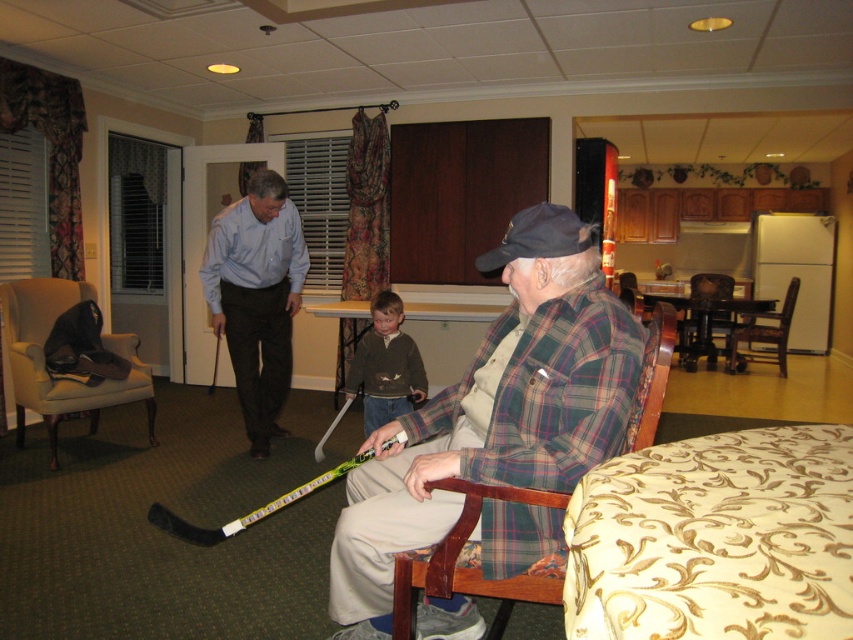
Between plaid flannel shirt at center and light blue shirt at center, which one appears on the right side from the viewer's perspective?

plaid flannel shirt at center is more to the right.

Can you confirm if plaid flannel shirt at center is wider than light blue shirt at center?

Indeed, plaid flannel shirt at center has a greater width compared to light blue shirt at center.

Does point (508, 392) come farther from viewer compared to point (283, 371)?

No, it is not.

You are a GUI agent. You are given a task and a screenshot of the screen. Output one action in this format:
    pyautogui.click(x=<x>, y=<y>)
    Task: Click on the plaid flannel shirt at center
    
    Given the screenshot: What is the action you would take?
    (498, 408)

Is plaid flannel shirt at center further to camera compared to beige fabric wingback chair at left?

That is False.

What do you see at coordinates (498, 408) in the screenshot? This screenshot has width=853, height=640. I see `plaid flannel shirt at center` at bounding box center [498, 408].

Which is in front, point (624, 330) or point (109, 339)?

Point (624, 330) is more forward.

Identify the location of plaid flannel shirt at center. Image resolution: width=853 pixels, height=640 pixels. (498, 408).

Who is more distant from viewer, [798,611] or [213,365]?

The point [213,365] is more distant.

From the picture: Can you confirm if gold embroidered tablecloth at lower right is positioned above black plastic hockey stick at center?

Incorrect, gold embroidered tablecloth at lower right is not positioned above black plastic hockey stick at center.

Where is `gold embroidered tablecloth at lower right`? gold embroidered tablecloth at lower right is located at coordinates click(715, 540).